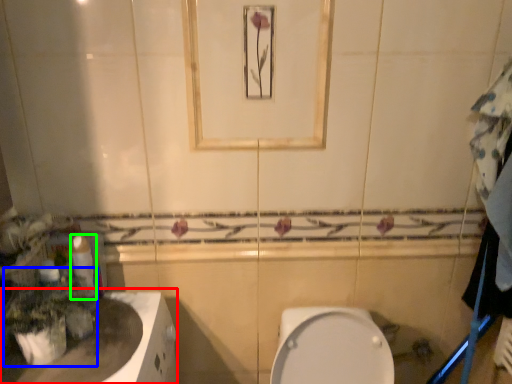
Question: Which object is positioned farthest from counter top (highlighted by a red box)? Select from plant (highlighted by a blue box) and toilet paper (highlighted by a green box).

Choices:
 (A) plant
 (B) toilet paper

Answer: (B)